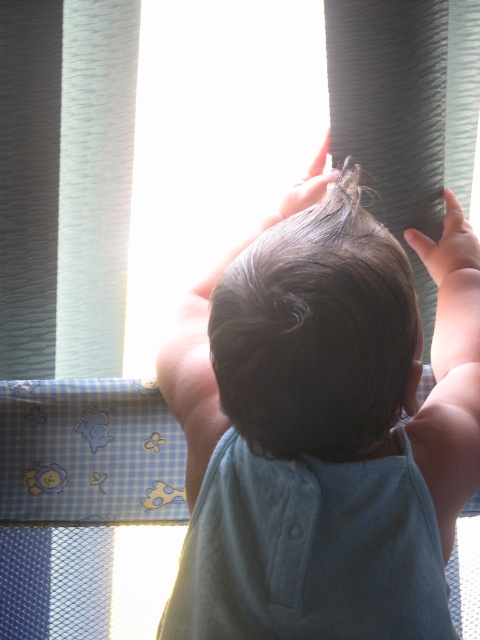
Question: Is dark brown hair at center thinner than dark brown smooth hair at center?

Choices:
 (A) no
 (B) yes

Answer: (A)

Question: Which point is farther to the camera?

Choices:
 (A) dark brown hair at center
 (B) dark brown smooth hair at center

Answer: (A)

Question: Which point appears closest to the camera in this image?

Choices:
 (A) (252, 582)
 (B) (452, 227)

Answer: (A)

Question: Is dark brown hair at center below dark brown smooth hair at center?

Choices:
 (A) yes
 (B) no

Answer: (A)

Question: Which object appears farthest from the camera in this image?

Choices:
 (A) dark brown hair at center
 (B) smooth skin hand at upper right
 (C) dark brown smooth hair at center

Answer: (B)

Question: Does dark brown hair at center appear under smooth skin hand at upper right?

Choices:
 (A) no
 (B) yes

Answer: (B)